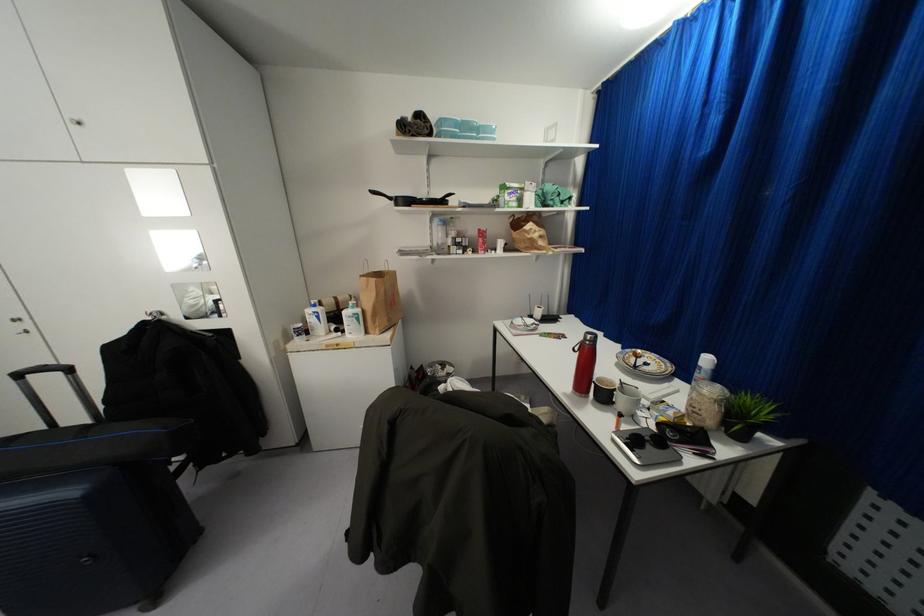
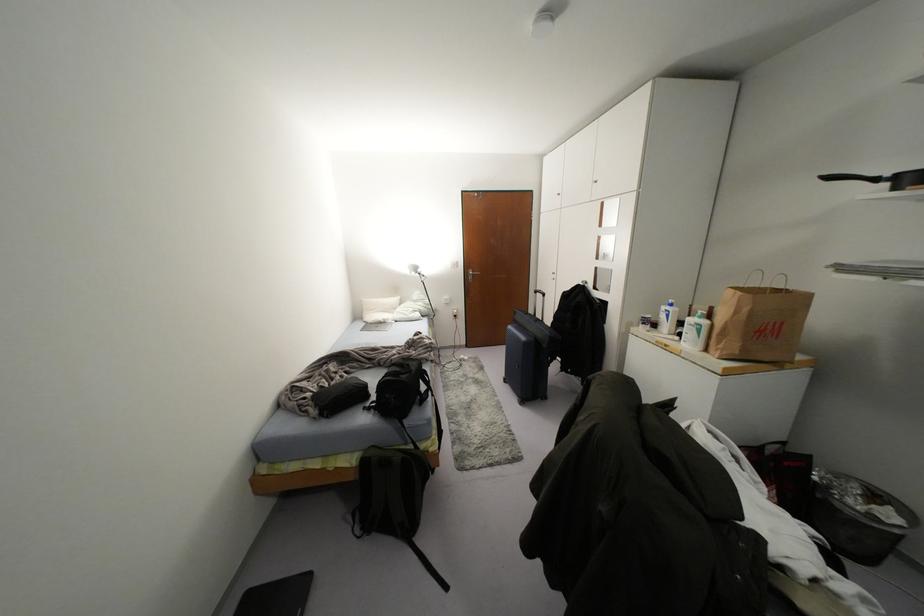
The point at (68,369) is marked in the first image. Where is the corresponding point in the second image?

(542, 294)